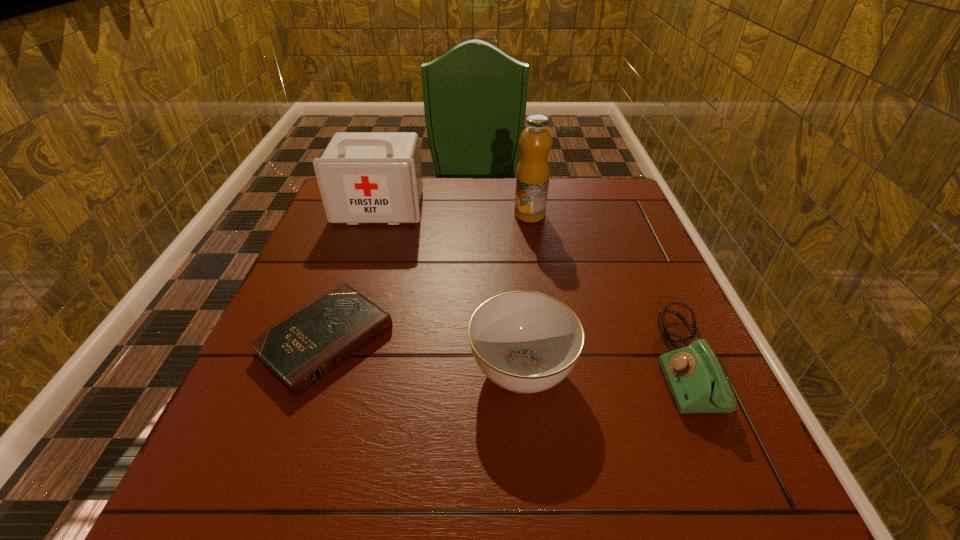
I want to click on unoccupied area between the shortest object and the chinaware, so click(x=424, y=355).

Where is `free space between the tallest object and the first-aid kit`? free space between the tallest object and the first-aid kit is located at coordinates (455, 211).

In order to click on object that stands as the second closest to the second shortest object in this screenshot , I will do click(x=532, y=178).

Find the location of a particular element. object that stands as the second closest to the fruit juice is located at coordinates (697, 382).